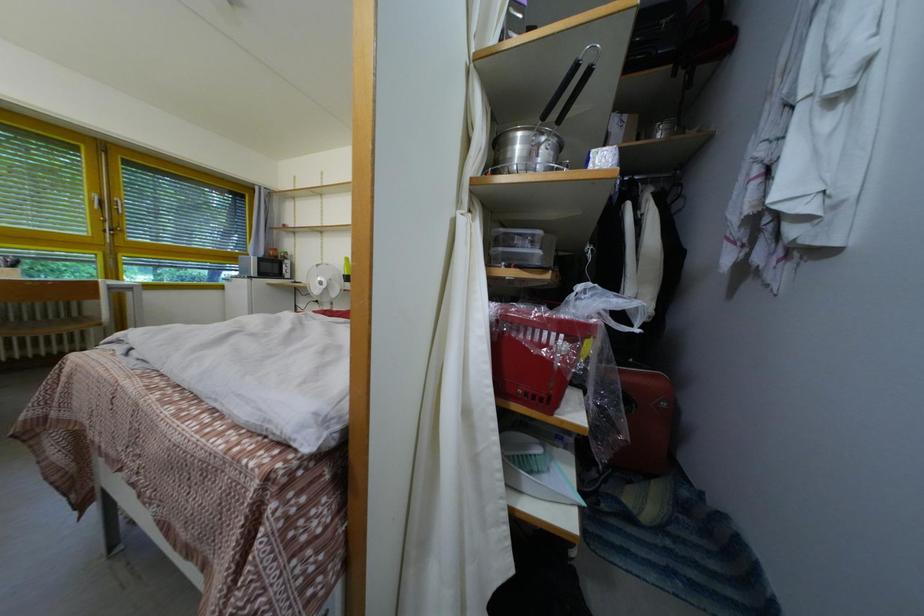
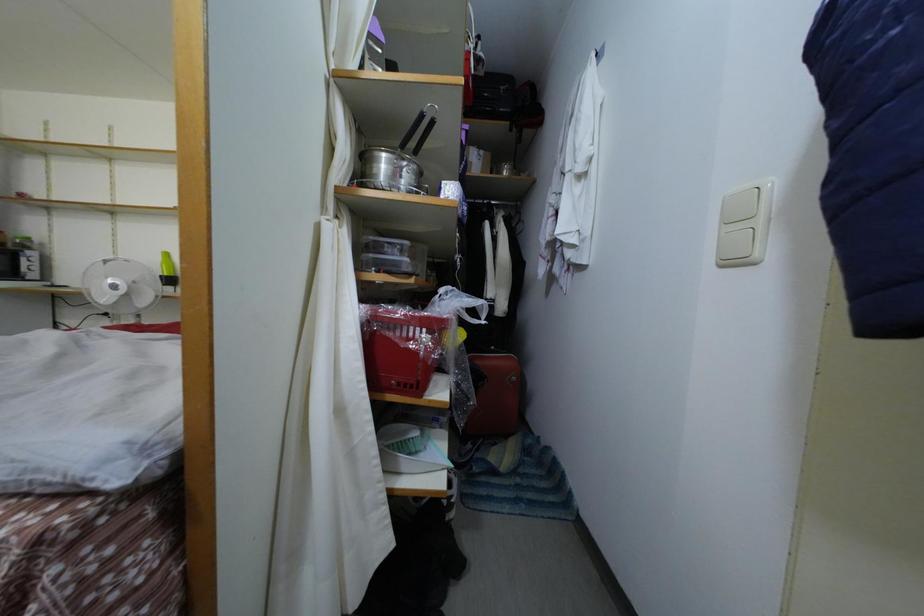
What movement of the cameraman would produce the second image?

The cameraman walked toward right, backward.